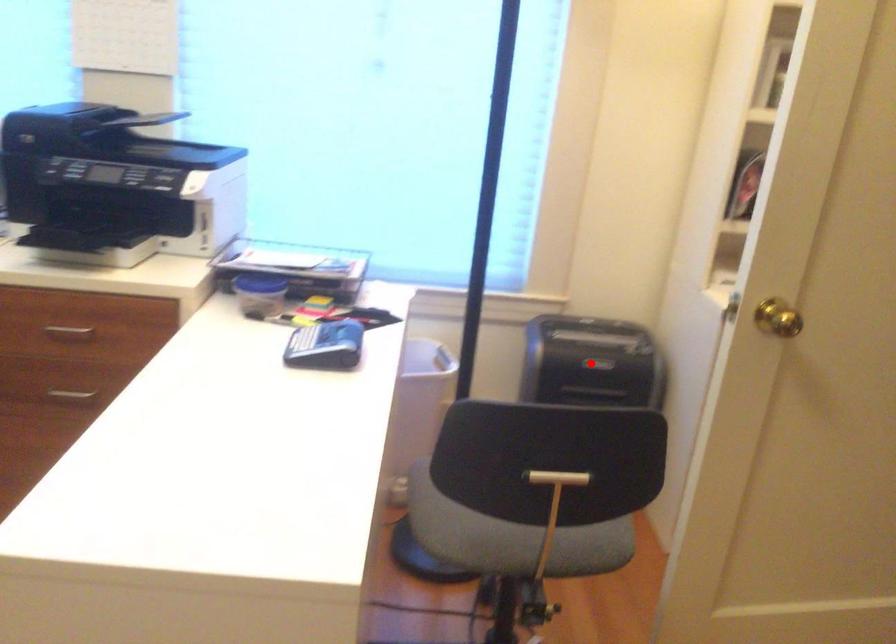
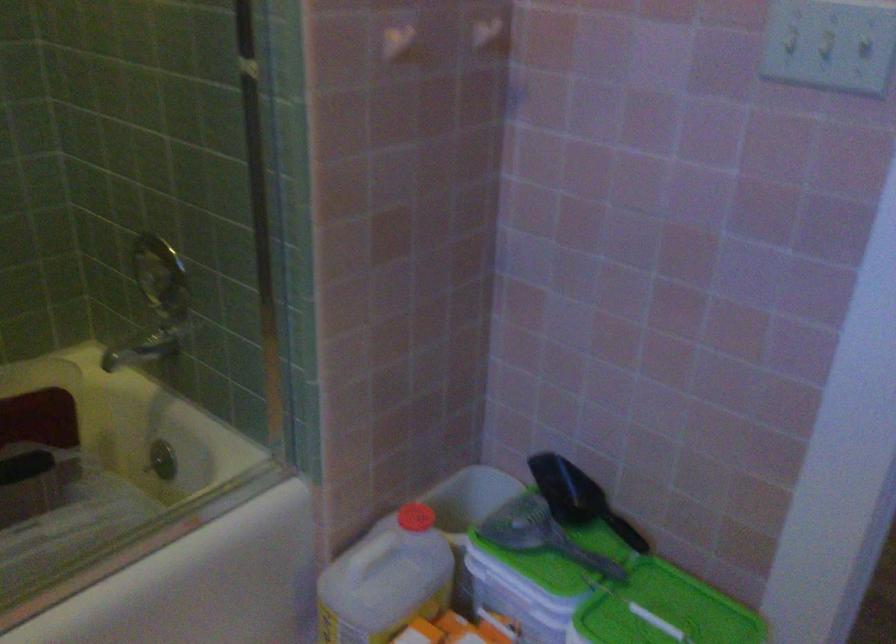
Question: I am providing you with two images of the same scene from different viewpoints. A red point is marked on the first image. Is the red point's position out of view in image 2?

Choices:
 (A) Yes
 (B) No

Answer: (A)